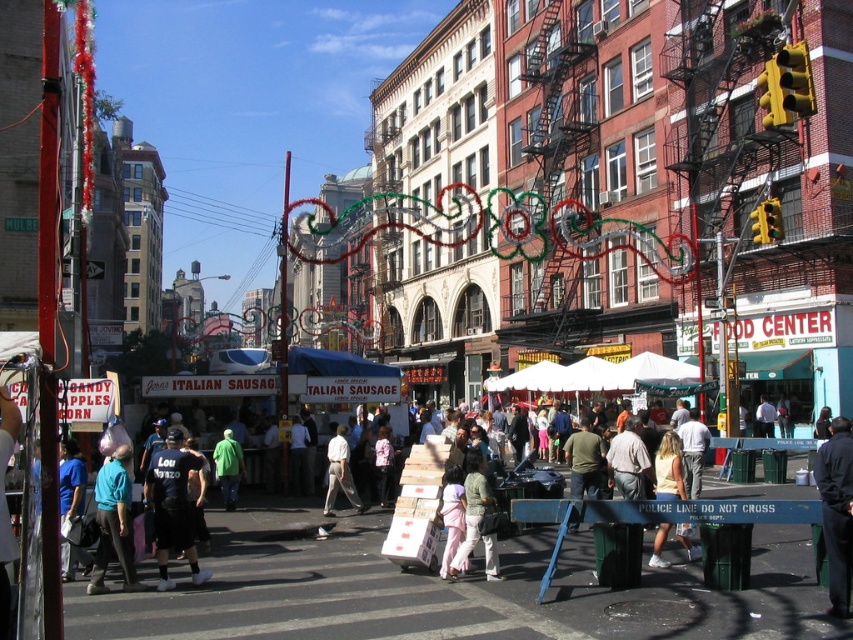
You are a photographer standing at the edge of the street. You want to capture both the teal fabric shirt at center and the light beige cotton dress at center in a single photo. Given that your camera has a maximum focus range of 25 meters, will you be able to include both subjects in the frame without moving closer?

The distance between the teal fabric shirt at center and the light beige cotton dress at center is 26.00 meters, which exceeds the camera maximum focus range of 25 meters. Therefore, you cannot capture both subjects in a single photo without moving closer.